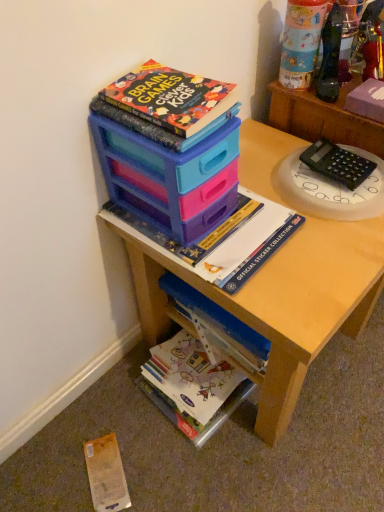
Locate an element on the screen. This screenshot has width=384, height=512. vacant space in between wooden desk at center and white glossy book at lower center, the 3th book in the top-to-bottom sequence is located at coordinates (202, 434).